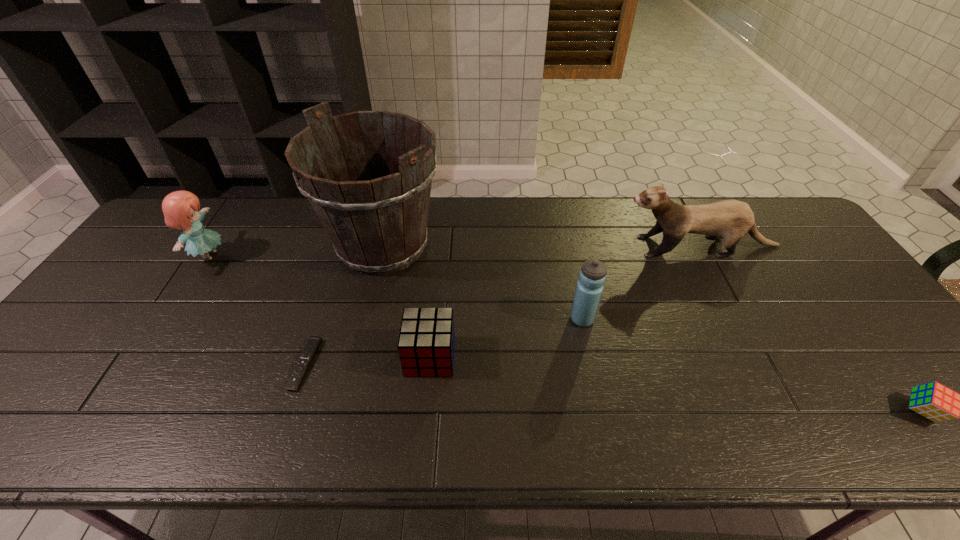
Locate an element on the screen. Image resolution: width=960 pixels, height=540 pixels. vacant space positioned 0.300m on the left of the bucket is located at coordinates (225, 246).

You are a GUI agent. You are given a task and a screenshot of the screen. Output one action in this format:
    pyautogui.click(x=<x>, y=<y>)
    Task: Click on the free space located 0.200m on the front-facing side of the doll
    Image resolution: width=960 pixels, height=540 pixels.
    Given the screenshot: What is the action you would take?
    click(294, 256)

Locate an element on the screen. vacant space located on the face of the sixth object from left to right is located at coordinates (523, 246).

You are a GUI agent. You are given a task and a screenshot of the screen. Output one action in this format:
    pyautogui.click(x=<x>, y=<y>)
    Task: Click on the vacant space located 0.160m on the face of the sixth object from left to right
    
    Given the screenshot: What is the action you would take?
    pyautogui.click(x=568, y=246)

Find the location of a particular element. free space located 0.390m on the face of the sixth object from left to right is located at coordinates (494, 246).

Locate an element on the screen. vacant region located 0.060m on the left of the fourth nearest object is located at coordinates (547, 319).

The height and width of the screenshot is (540, 960). Identify the location of free space located 0.050m on the left of the taller cube. (386, 356).

Where is `vacant region located on the left of the nearest object`? The image size is (960, 540). vacant region located on the left of the nearest object is located at coordinates (855, 411).

I want to click on vacant position located on the back of the shortest object, so click(x=335, y=273).

This screenshot has width=960, height=540. Identify the location of bucket that is positioned at the far edge. (376, 227).